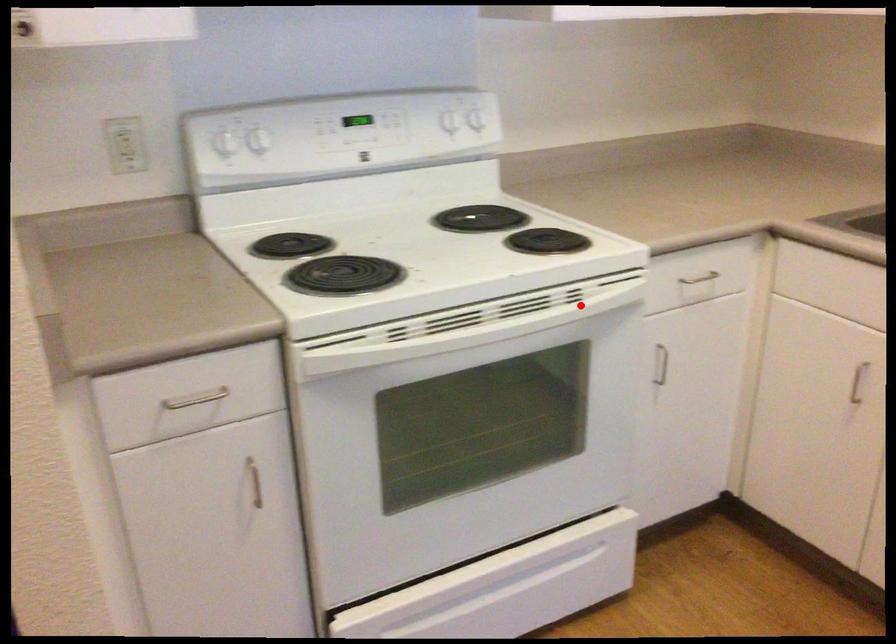
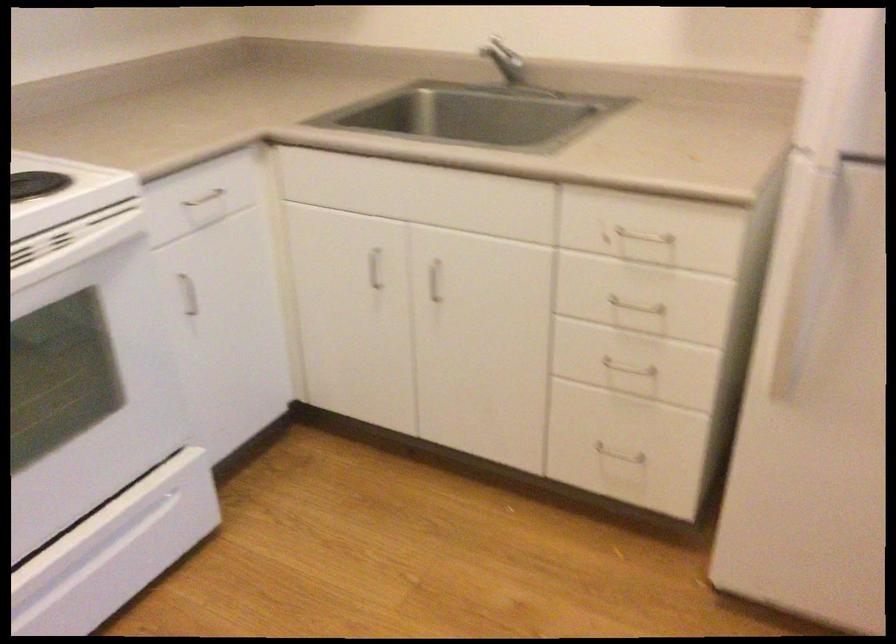
In the second image, find the point that corresponds to the highlighted location in the first image.

(73, 243)